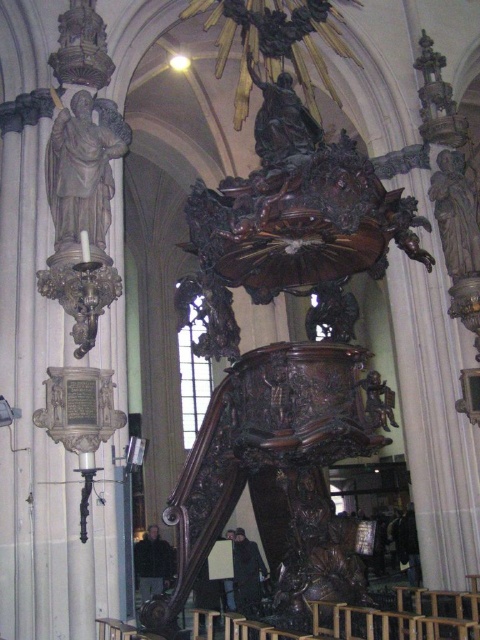
You are an art conservator assessing the space between the brown polished wood statue at right and the bronze statue at upper center. Based on their widths, which statue might require more space when moving them individually?

The brown polished wood statue at right might require more space when moving them individually because it might be wider than bronze statue at upper center according to the description.

You are an art student visiting the cathedral and want to sketch both the matte stone statue at left and the brown polished wood statue at right. Since you can only focus on one statue at a time, which statue should you stand closer to if you want to draw them both without moving your chair?

→ You should stand closer to the matte stone statue at left because it is positioned on the left side of the brown polished wood statue at right, so being closer to the left statue allows you to capture both in your field of view without moving.